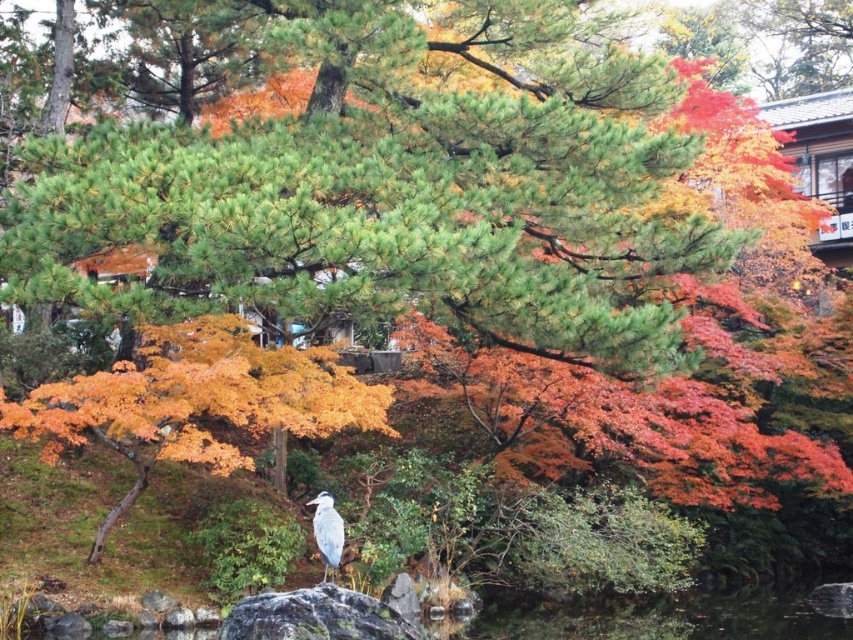
You are an ornithologist observing the scene and want to document the position of the white matte bird at center relative to the orange matte maple at center. Which object is located to the right of the other?

The white matte bird at center is located to the right of the orange matte maple at center.

You are a photographer standing in the Japanese garden. You see the orange matte maple at center and the white matte bird at center. Which object is positioned higher in the scene?

The orange matte maple at center is positioned higher than the white matte bird at center.

Looking at this image, you are a photographer planning to capture a closeup shot of the orange matte maple at center and the white matte bird at center. Since you want to focus on the maple, which object should you position closer to the camera?

The orange matte maple at center is bigger than the white matte bird at center, so to focus on the maple, position it closer to the camera.